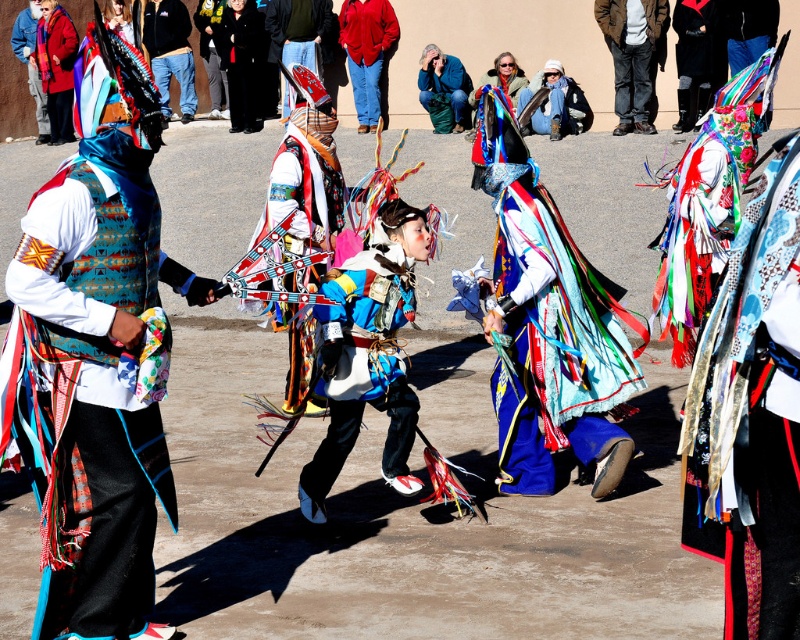
You are a photographer at the dance performance and want to capture both the velvet black coat at upper right and the matte black jacket at upper left in a single photo. Which of these two items should you focus on first if you want to ensure they are both in sharp focus?

The velvet black coat at upper right is shorter than the matte black jacket at upper left. To ensure both are in sharp focus, you should focus on the matte black jacket at upper left since it is farther away and requires a greater depth of field.

In the scene shown: You are a photographer at the event and want to capture both the embroidered silk dress at right and the blue denim jacket at upper center in a single frame. Which object should you focus on first to ensure both are in the frame?

The embroidered silk dress at right is smaller than the blue denim jacket at upper center, so you should focus on the blue denim jacket at upper center first to ensure both are in the frame.